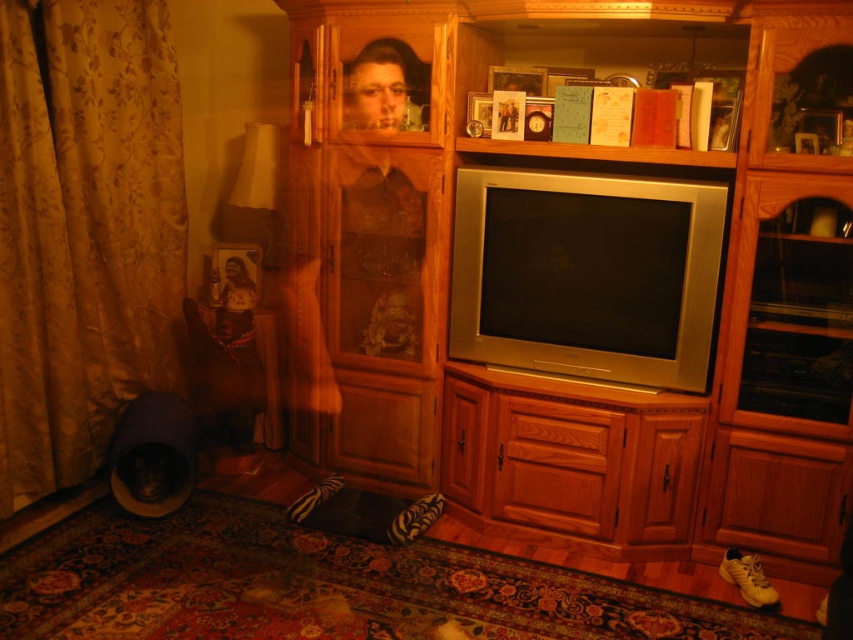
Question: Which point is farther to the camera?

Choices:
 (A) wooden entertainment center at center
 (B) gold fabric curtain at left

Answer: (B)

Question: Which of the following is the farthest from the observer?

Choices:
 (A) gold fabric curtain at left
 (B) wooden entertainment center at center

Answer: (A)

Question: Does wooden entertainment center at center have a greater width compared to gold fabric curtain at left?

Choices:
 (A) no
 (B) yes

Answer: (B)

Question: Is wooden entertainment center at center behind gold fabric curtain at left?

Choices:
 (A) no
 (B) yes

Answer: (A)

Question: Is wooden entertainment center at center above gold fabric curtain at left?

Choices:
 (A) no
 (B) yes

Answer: (A)